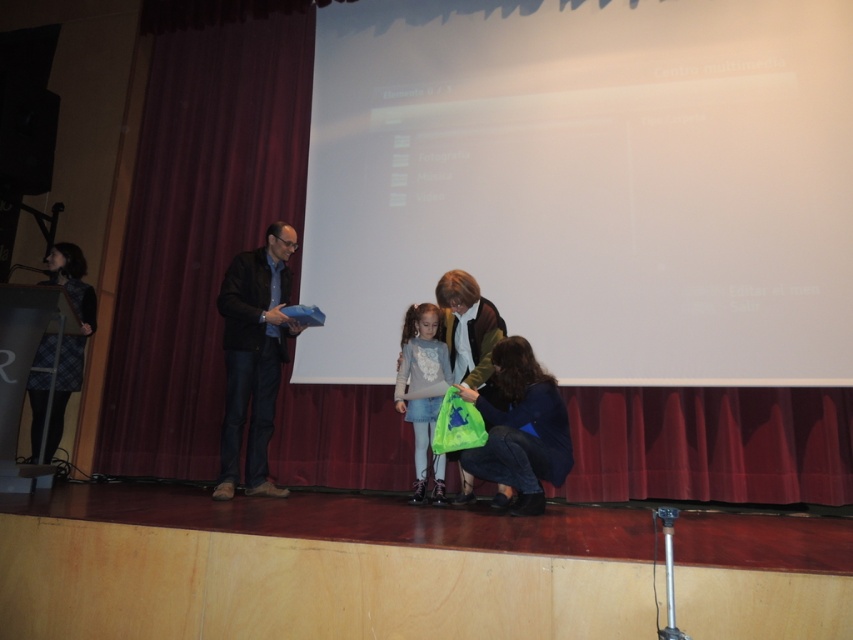
You are an event photographer positioned at the back of the stage. You need to capture a clear photo of both the matte green jacket at center and the plaid fabric dress at left. Which one will appear larger in your photo?

The matte green jacket at center will appear larger in the photo because it is closer to the viewer than the plaid fabric dress at left.

You are standing at the front of the stage and want to move to the point marked at coordinates point [67,348]. How far will you have to walk to reach it?

The point [67,348] is 4.66 meters from the viewer, so you will have to walk 4.66 meters to reach it.

You are a photographer at the event and need to capture a photo of both the plaid fabric dress at left and the matte gray sweater at center. Based on their positions, which one is more to the left?

The plaid fabric dress at left is more to the left than the matte gray sweater at center.